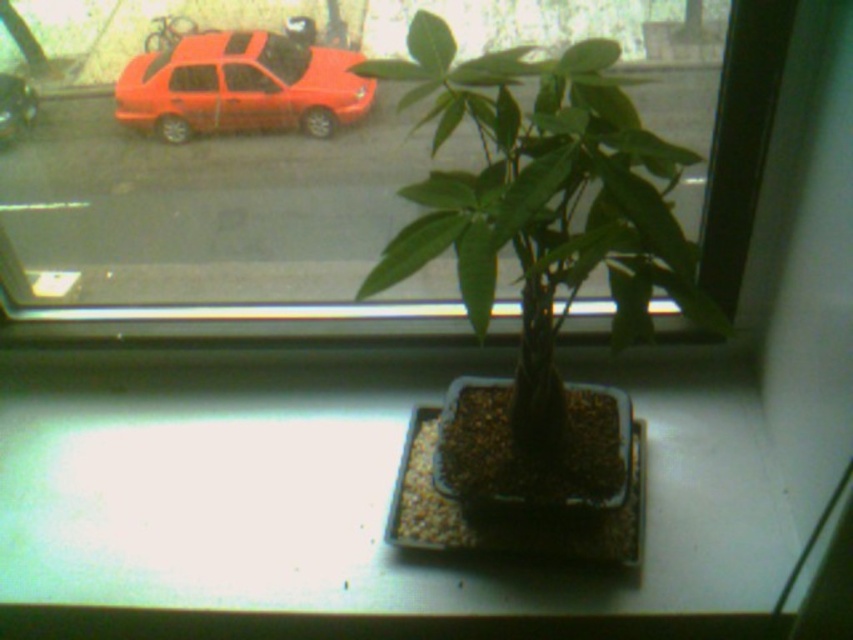
Question: Is white matte window sill at center further to camera compared to transparent glass window at center?

Choices:
 (A) no
 (B) yes

Answer: (A)

Question: Does matte red car at upper left lie behind metallic red car at upper left?

Choices:
 (A) yes
 (B) no

Answer: (B)

Question: Which object is the closest to the green matte plant at center?

Choices:
 (A) metallic red car at upper left
 (B) matte red car at upper left
 (C) white matte window sill at center

Answer: (C)

Question: Which point appears farthest from the camera in this image?

Choices:
 (A) (537, 108)
 (B) (3, 140)
 (C) (241, 12)

Answer: (B)

Question: Does transparent glass window at center appear on the right side of green matte plant at center?

Choices:
 (A) no
 (B) yes

Answer: (A)

Question: Which point is farther to the camera?

Choices:
 (A) transparent glass window at center
 (B) green matte plant at center
 (C) metallic red car at upper left

Answer: (C)